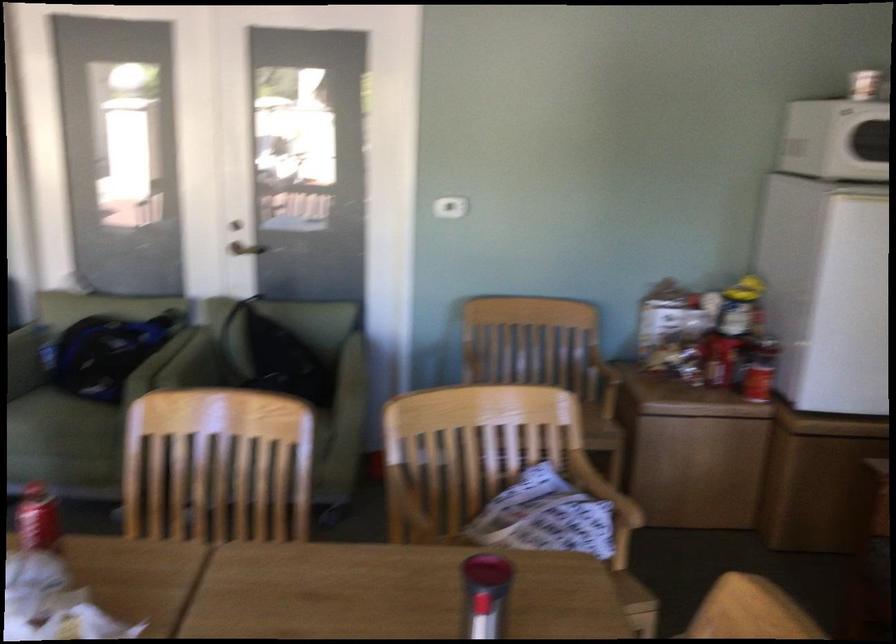
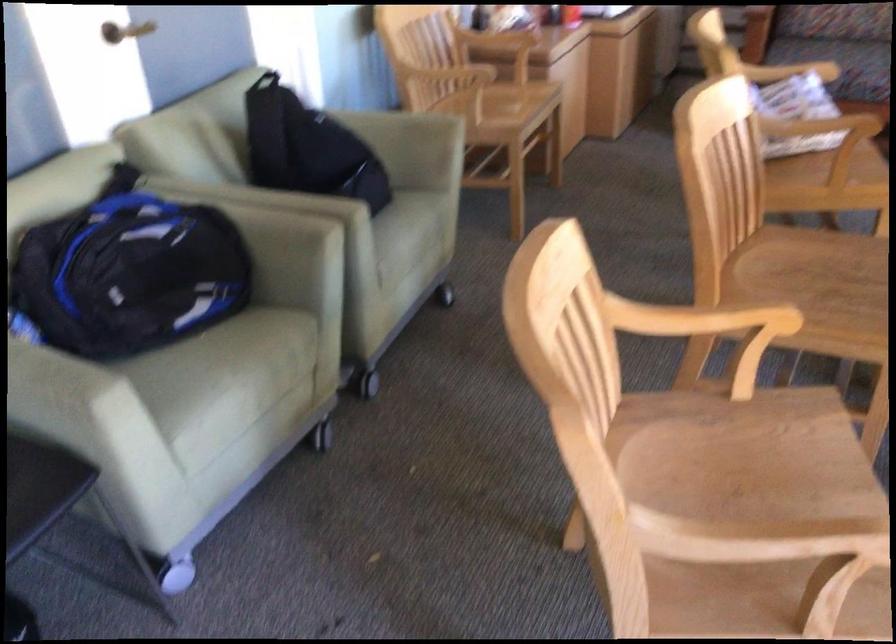
Question: I am providing you with two images of the same scene from different viewpoints. Please identify which objects are invisible in image2.

Choices:
 (A) sofa sitting surface
 (B) caster wheel
 (C) black backpack
 (D) none of these

Answer: (D)